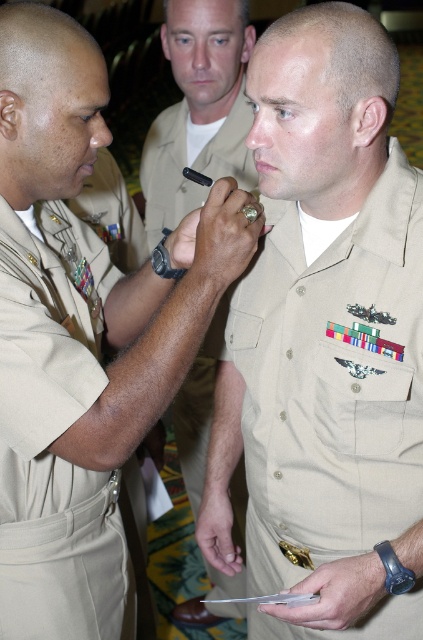
Question: Which of the following is the closest to the observer?

Choices:
 (A) (55, 518)
 (B) (417, 621)

Answer: (B)

Question: Which object is the closest to the tan uniform at center?

Choices:
 (A) tan/khaki fabric uniform at left
 (B) tan uniform shirt at center

Answer: (B)

Question: In this image, where is tan uniform at center located relative to matte khaki uniform at center?

Choices:
 (A) below
 (B) above

Answer: (A)

Question: Estimate the real-world distances between objects in this image. Which object is closer to the tan uniform at center?

Choices:
 (A) tan/khaki fabric uniform at left
 (B) matte khaki uniform at center
 (C) tan uniform shirt at center

Answer: (C)

Question: Can you confirm if tan uniform shirt at center is positioned to the right of tan uniform at center?

Choices:
 (A) no
 (B) yes

Answer: (A)

Question: Can you confirm if tan uniform at center is bigger than tan/khaki fabric uniform at left?

Choices:
 (A) no
 (B) yes

Answer: (B)